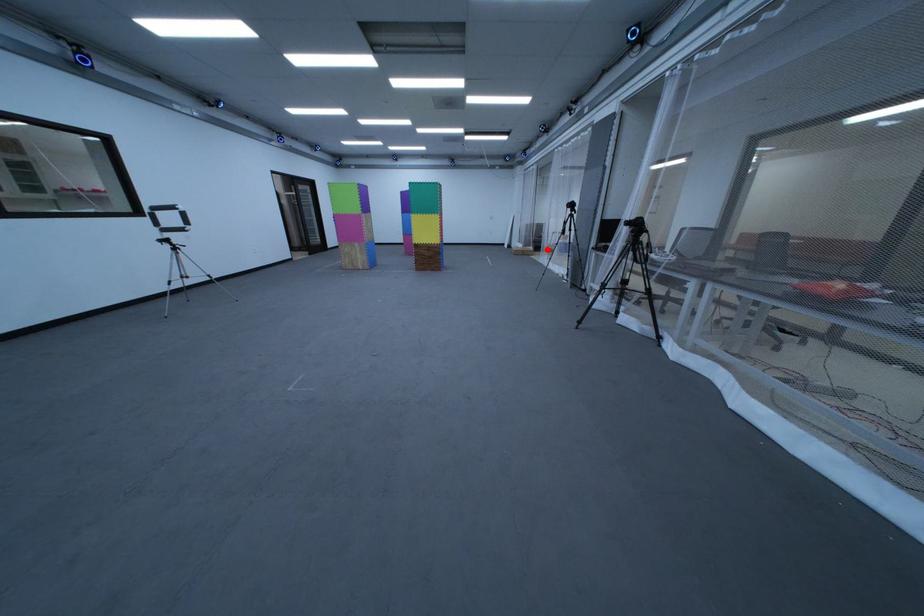
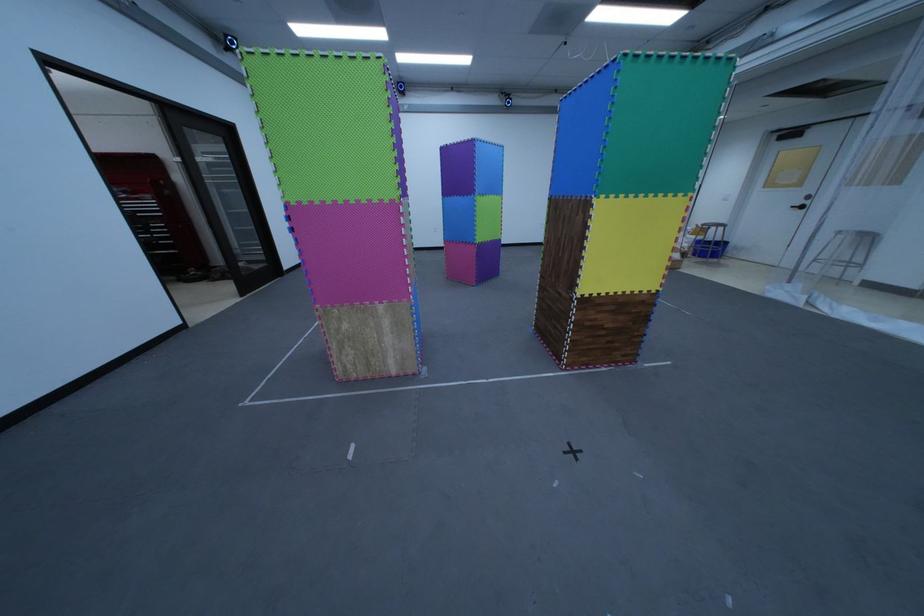
The point at the highlighted location is marked in the first image. Where is the corresponding point in the second image?

(691, 257)